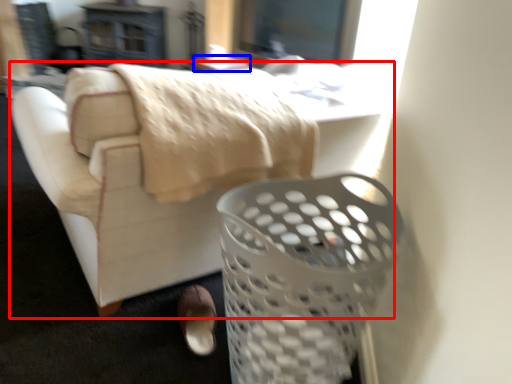
Question: Which of the following is the closest to the observer, furniture (highlighted by a red box) or table (highlighted by a blue box)?

Choices:
 (A) furniture
 (B) table

Answer: (A)